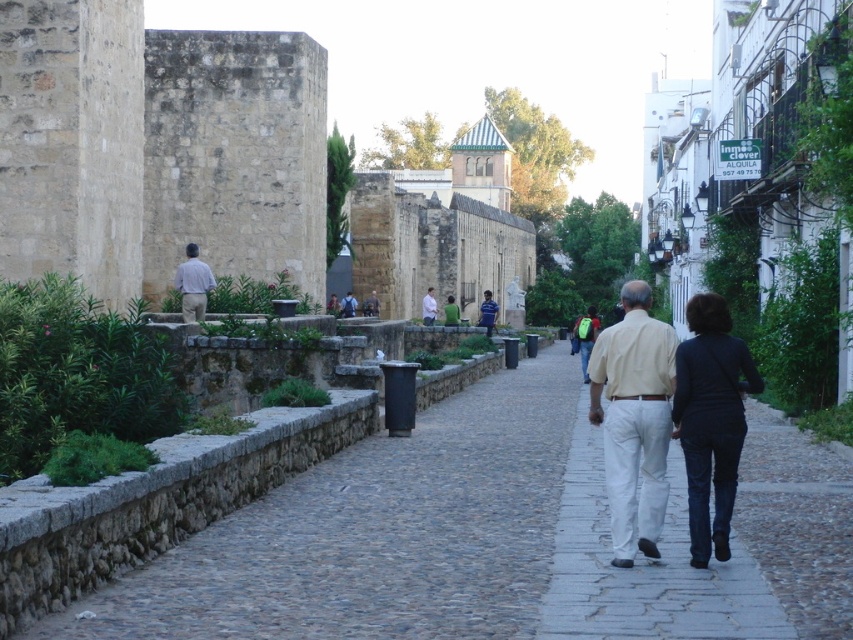
You are a traveler walking along the cobblestone pathway between the historic stone walls and the white buildings. You notice two shirts hanging from a clothesline stretched between two poles at the center of the path. Which shirt is taller when comparing the beige cotton shirt at center and the white cotton shirt at center?

The beige cotton shirt at center is much taller than the white cotton shirt at center.

From the picture: You are standing on a cobblestone pathway surrounded by historic stone walls and white buildings with balconies. You notice two shirts hanging on a clothesline between two buildings at the center of the path. Which shirt is closer to you, the beige cotton shirt at center or the white cotton shirt at center?

The beige cotton shirt at center is closer to the viewer than the white cotton shirt at center.